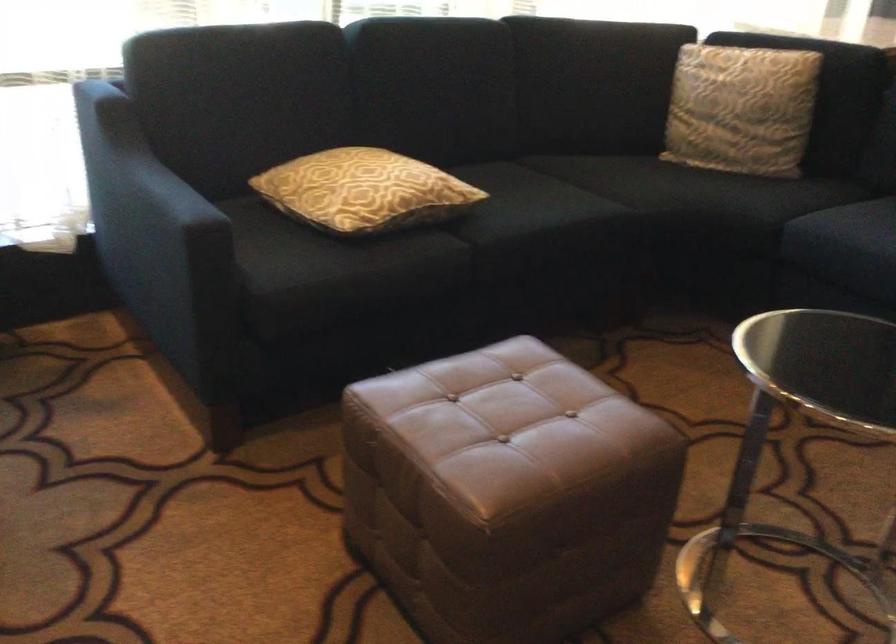
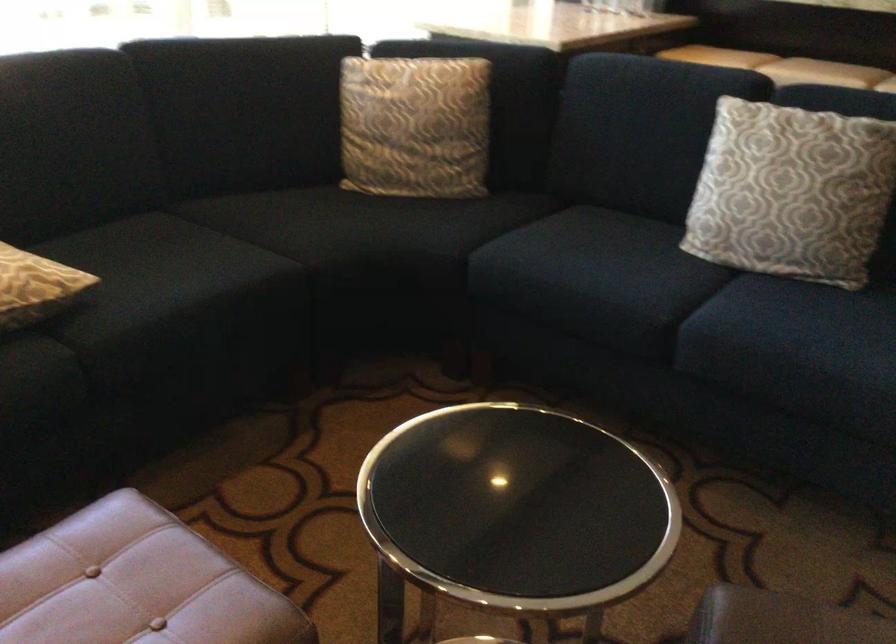
The point at (584,80) is marked in the first image. Where is the corresponding point in the second image?

(238, 111)